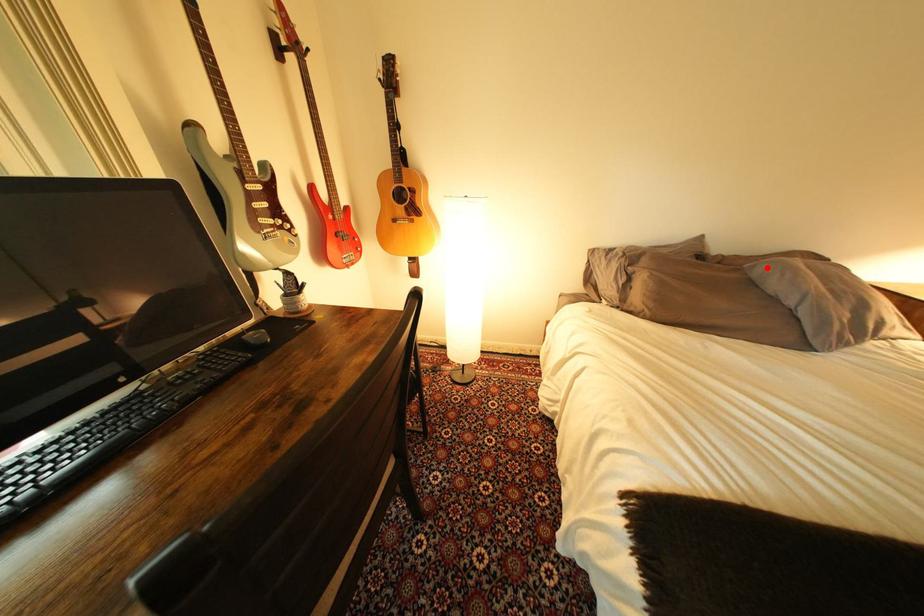
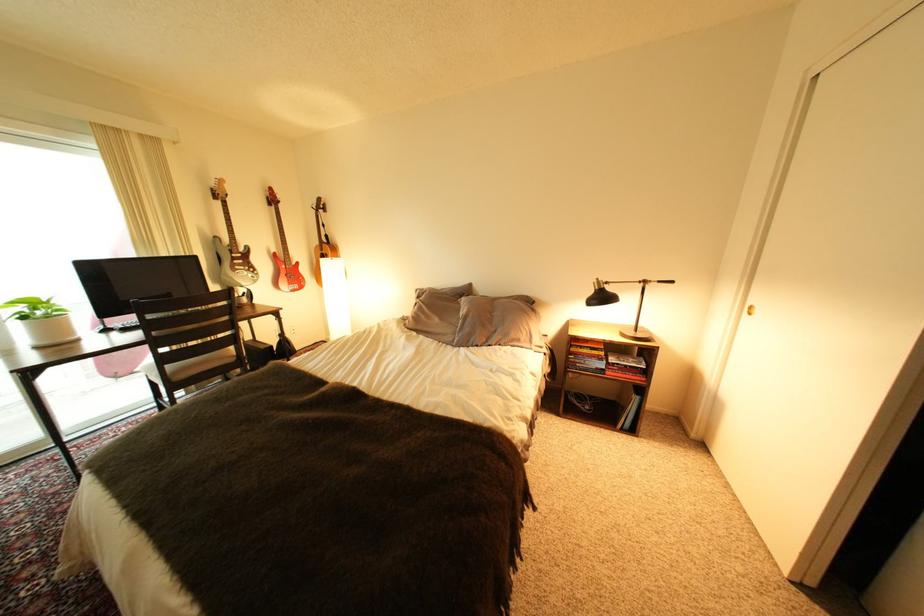
In the second image, find the point that corresponds to the highlighted location in the first image.

(473, 302)